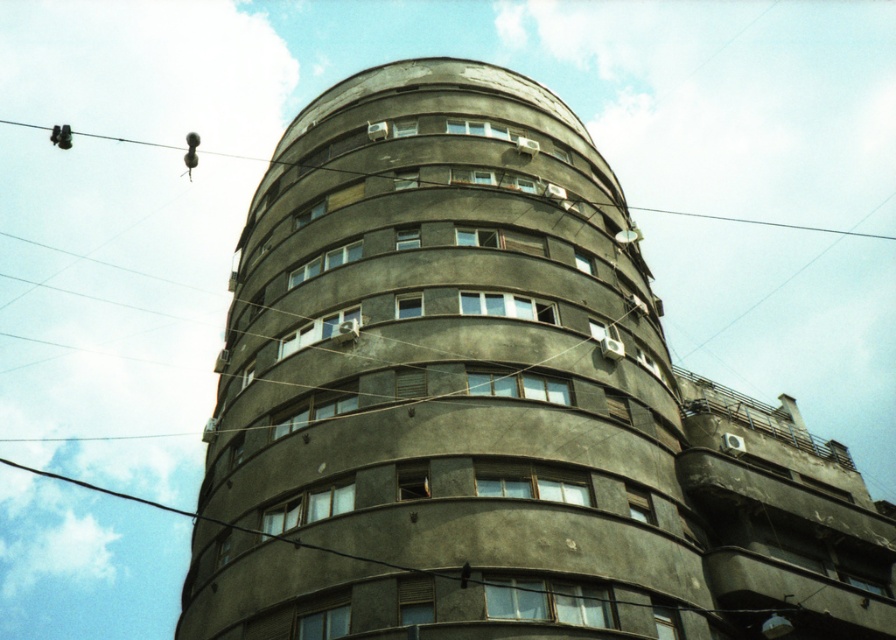
Question: Can you confirm if dark gray concrete building at center is positioned below metallic wire at upper center?

Choices:
 (A) yes
 (B) no

Answer: (A)

Question: Is dark gray concrete building at center further to the viewer compared to metallic wire at upper center?

Choices:
 (A) no
 (B) yes

Answer: (A)

Question: Is dark gray concrete building at center positioned at the back of metallic wire at upper center?

Choices:
 (A) yes
 (B) no

Answer: (B)

Question: Among these points, which one is farthest from the camera?

Choices:
 (A) (567, 144)
 (B) (653, 208)

Answer: (B)